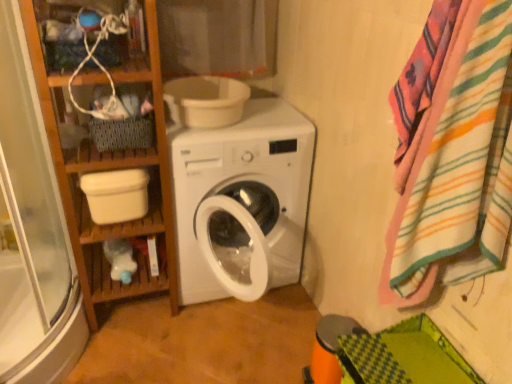
Question: Is white plastic bowl at upper center, the first toilet bowl from the right, turned away from wooden bookshelf at left?

Choices:
 (A) no
 (B) yes

Answer: (A)

Question: Can you confirm if white plastic bowl at upper center, the 1th toilet bowl from the top, is positioned to the left of wooden bookshelf at left?

Choices:
 (A) yes
 (B) no

Answer: (B)

Question: Is white plastic bowl at upper center, the first toilet bowl from the right, outside wooden bookshelf at left?

Choices:
 (A) no
 (B) yes

Answer: (B)

Question: From the image's perspective, is white plastic bowl at upper center, the 2th toilet bowl when ordered from left to right, on top of wooden bookshelf at left?

Choices:
 (A) no
 (B) yes

Answer: (B)

Question: Considering the relative positions of white plastic bowl at upper center, the 2th toilet bowl when ordered from left to right, and wooden bookshelf at left in the image provided, is white plastic bowl at upper center, the 2th toilet bowl when ordered from left to right, to the right of wooden bookshelf at left from the viewer's perspective?

Choices:
 (A) yes
 (B) no

Answer: (A)

Question: From a real-world perspective, is white plastic bowl at upper center, the 2th toilet bowl when ordered from left to right, physically above wooden bookshelf at left?

Choices:
 (A) yes
 (B) no

Answer: (A)

Question: Can you confirm if woven fabric basket at upper left is shorter than white plastic bowl at upper center, the 2th toilet bowl when ordered from left to right?

Choices:
 (A) no
 (B) yes

Answer: (A)

Question: Does woven fabric basket at upper left come behind white plastic bowl at upper center, which appears as the second toilet bowl when ordered from the bottom?

Choices:
 (A) no
 (B) yes

Answer: (A)

Question: Can you confirm if woven fabric basket at upper left is smaller than white plastic bowl at upper center, which appears as the second toilet bowl when ordered from the bottom?

Choices:
 (A) yes
 (B) no

Answer: (A)

Question: From a real-world perspective, is woven fabric basket at upper left positioned over white plastic bowl at upper center, which appears as the second toilet bowl when ordered from the bottom, based on gravity?

Choices:
 (A) no
 (B) yes

Answer: (A)

Question: Is woven fabric basket at upper left positioned far away from white plastic bowl at upper center, the 1th toilet bowl from the top?

Choices:
 (A) yes
 (B) no

Answer: (B)

Question: Is woven fabric basket at upper left completely or partially outside of white plastic bowl at upper center, the 2th toilet bowl when ordered from left to right?

Choices:
 (A) yes
 (B) no

Answer: (A)

Question: Can you confirm if wooden shelf at upper left is smaller than woven fabric basket at upper left?

Choices:
 (A) yes
 (B) no

Answer: (B)